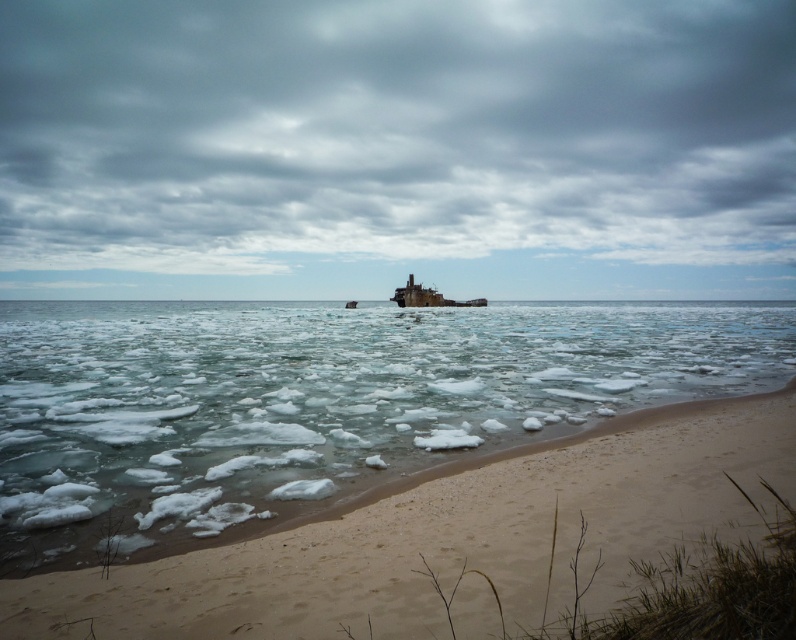
Question: Among these objects, which one is nearest to the camera?

Choices:
 (A) cloudy sky at upper center
 (B) rusty metal shipwreck at center

Answer: (B)

Question: Can you confirm if translucent ice at center is thinner than rusty metal shipwreck at center?

Choices:
 (A) yes
 (B) no

Answer: (B)

Question: Does cloudy sky at upper center have a larger size compared to rusty metal shipwreck at center?

Choices:
 (A) yes
 (B) no

Answer: (A)

Question: Which of the following is the farthest from the observer?

Choices:
 (A) (430, 246)
 (B) (244, 428)
 (C) (416, 285)

Answer: (A)

Question: Does cloudy sky at upper center appear on the right side of rusty metal shipwreck at center?

Choices:
 (A) yes
 (B) no

Answer: (B)

Question: Which of these objects is positioned closest to the rusty metal shipwreck at center?

Choices:
 (A) cloudy sky at upper center
 (B) translucent ice at center

Answer: (B)